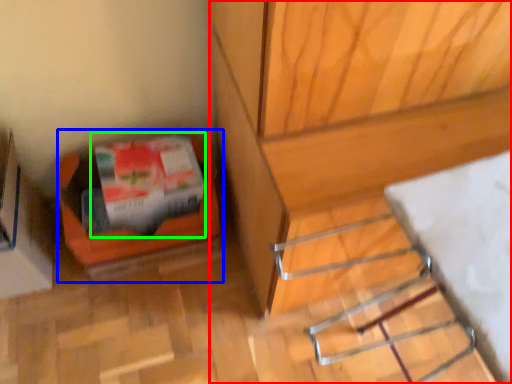
Question: Which object is positioned farthest from furniture (highlighted by a red box)? Select from box (highlighted by a blue box) and wrapping paper (highlighted by a green box).

Choices:
 (A) box
 (B) wrapping paper

Answer: (A)